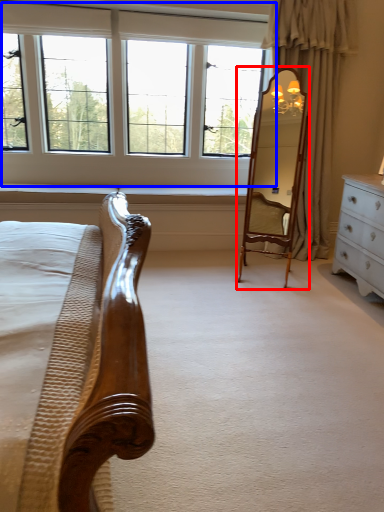
Question: Which point is closer to the camera, mirror (highlighted by a red box) or window (highlighted by a blue box)?

Choices:
 (A) mirror
 (B) window

Answer: (A)